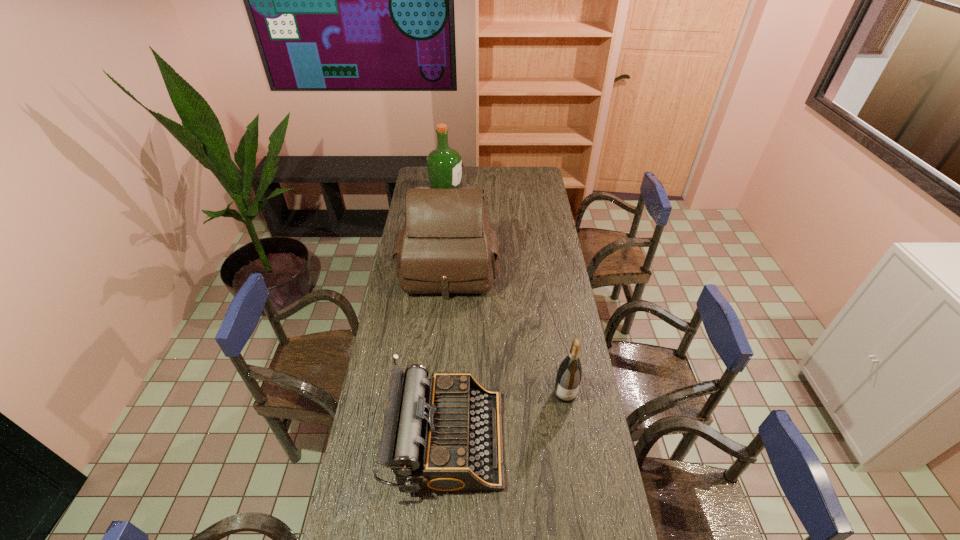
The image size is (960, 540). Find the location of `satchel`. satchel is located at coordinates (446, 246).

This screenshot has height=540, width=960. I want to click on liquor, so click(x=444, y=165).

Locate an element on the screen. The height and width of the screenshot is (540, 960). wine bottle is located at coordinates (569, 374).

At what (x,y) coordinates should I click in order to perform the action: click on the second shortest object. Please return your answer as a coordinate pair (x, y). Looking at the image, I should click on (569, 374).

Locate an element on the screen. The image size is (960, 540). typewriter is located at coordinates (444, 434).

At what (x,y) coordinates should I click in order to perform the action: click on free location located on the front flap of the second farthest object. Please return your answer as a coordinate pair (x, y). This screenshot has height=540, width=960. Looking at the image, I should click on (444, 348).

The image size is (960, 540). I want to click on free location located 0.220m on the front-facing side of the farthest object, so click(x=500, y=190).

Where is `vacant region located 0.120m on the label of the rightmost object`? vacant region located 0.120m on the label of the rightmost object is located at coordinates (572, 436).

I want to click on vacant space located 0.210m on the keyboard of the shortest object, so click(565, 439).

What are the coordinates of `object present at the far edge` in the screenshot? It's located at (444, 165).